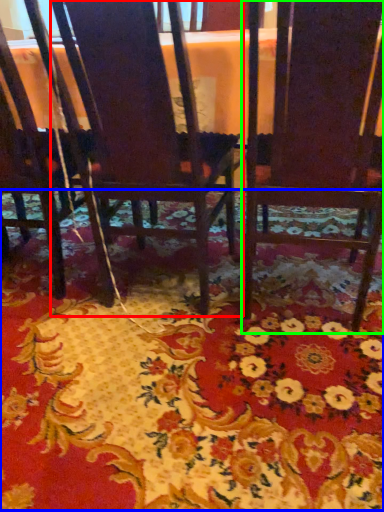
Question: Based on their relative distances, which object is farther from chair (highlighted by a red box)? Choose from mat (highlighted by a blue box) and chair (highlighted by a green box).

Choices:
 (A) mat
 (B) chair

Answer: (A)